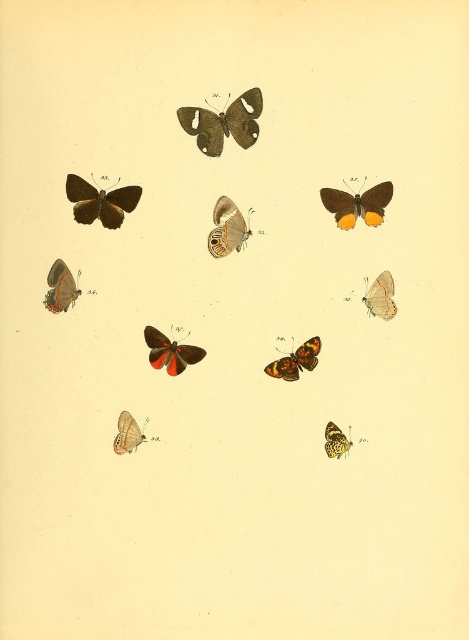
Question: Does shiny silver butterfly at bottom left have a lesser width compared to orange-brown speckled butterfly at center?

Choices:
 (A) no
 (B) yes

Answer: (A)

Question: Based on their relative distances, which object is nearer to the orange-brown spotted butterfly at center?

Choices:
 (A) brown matte butterfly at upper center
 (B) matte brown butterfly at left

Answer: (A)

Question: Which point appears farthest from the camera in this image?

Choices:
 (A) (370, 294)
 (B) (338, 435)
 (C) (158, 330)

Answer: (C)

Question: Can you confirm if brown textured butterfly at center is positioned above orange-brown metallic butterfly at center?

Choices:
 (A) yes
 (B) no

Answer: (A)

Question: Does orange-yellow spotted butterfly at upper right have a larger size compared to shiny silver butterfly at bottom left?

Choices:
 (A) yes
 (B) no

Answer: (A)

Question: Which point is closer to the camera?

Choices:
 (A) matte brown butterfly at left
 (B) orange-yellow spotted butterfly at upper right
 (C) orange-brown spotted butterfly at center
 (D) orange and black butterfly at center

Answer: (B)